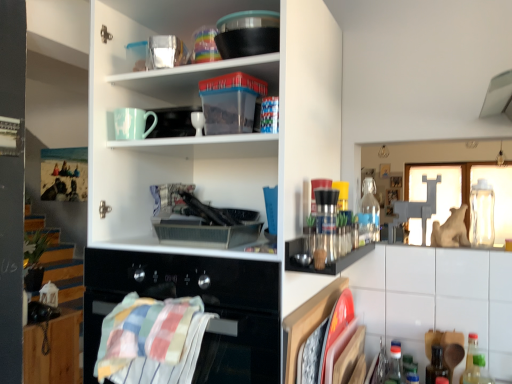
Question: Does white glossy cabinet at lower right, positioned as the second cabinetry in back-to-front order, appear on the right side of striped cotton towel at lower left?

Choices:
 (A) no
 (B) yes

Answer: (B)

Question: Is white glossy cabinet at lower right, the first cabinetry from the top, closer to camera compared to striped cotton towel at lower left?

Choices:
 (A) no
 (B) yes

Answer: (A)

Question: Does white glossy cabinet at lower right, the first cabinetry from the top, turn towards striped cotton towel at lower left?

Choices:
 (A) no
 (B) yes

Answer: (A)

Question: Does white glossy cabinet at lower right, the second cabinetry ordered from the bottom, contain striped cotton towel at lower left?

Choices:
 (A) yes
 (B) no

Answer: (B)

Question: Is white glossy cabinet at lower right, the 2th cabinetry in the left-to-right sequence, next to striped cotton towel at lower left and touching it?

Choices:
 (A) yes
 (B) no

Answer: (B)

Question: From the image's perspective, would you say white glossy cabinet at lower right, the 2th cabinetry in the left-to-right sequence, is shown under striped cotton towel at lower left?

Choices:
 (A) no
 (B) yes

Answer: (B)

Question: From a real-world perspective, is transparent plastic bottle at lower right, which is the 2th bottle from left to right, physically below clear glass bottle at upper right, the first bottle in the left-to-right sequence?

Choices:
 (A) yes
 (B) no

Answer: (A)

Question: Is transparent plastic bottle at lower right, arranged as the 3th bottle when viewed from the back, next to clear glass bottle at upper right, arranged as the 1th bottle when viewed from the back, and touching it?

Choices:
 (A) yes
 (B) no

Answer: (B)

Question: Is transparent plastic bottle at lower right, arranged as the 3th bottle when viewed from the back, facing towards clear glass bottle at upper right, which is counted as the fifth bottle, starting from the right?

Choices:
 (A) no
 (B) yes

Answer: (A)

Question: Can you confirm if transparent plastic bottle at lower right, which is counted as the third bottle, starting from the front, is thinner than clear glass bottle at upper right, the 5th bottle from the front?

Choices:
 (A) yes
 (B) no

Answer: (A)

Question: Is transparent plastic bottle at lower right, placed as the 4th bottle when sorted from right to left, bigger than clear glass bottle at upper right, which is counted as the fifth bottle, starting from the right?

Choices:
 (A) yes
 (B) no

Answer: (A)

Question: Is transparent plastic bottle at lower right, placed as the 4th bottle when sorted from right to left, to the left of clear glass bottle at upper right, the first bottle in the left-to-right sequence, from the viewer's perspective?

Choices:
 (A) yes
 (B) no

Answer: (B)

Question: Would you say white matte cupboard at upper left is part of blue plastic bottle at lower right, the third bottle when ordered from left to right,'s contents?

Choices:
 (A) no
 (B) yes

Answer: (A)